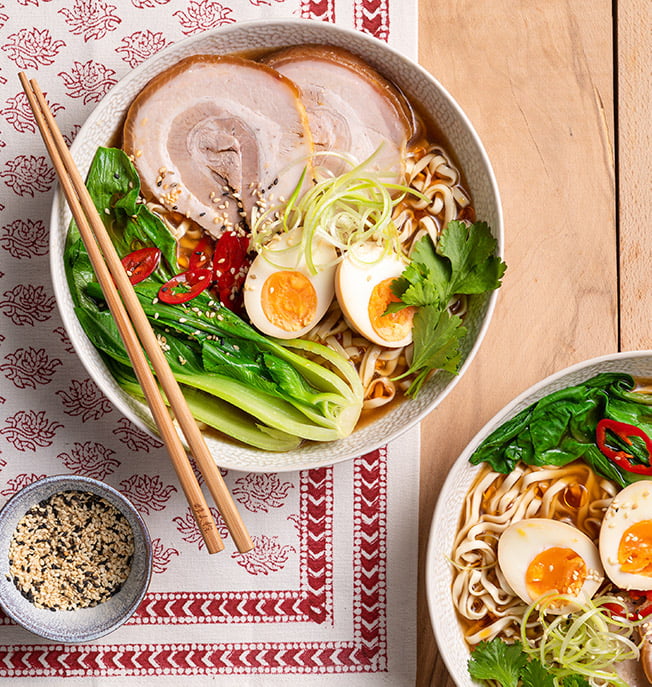
The width and height of the screenshot is (652, 687). What are the coordinates of `placemat` in the screenshot? It's located at (372, 602).